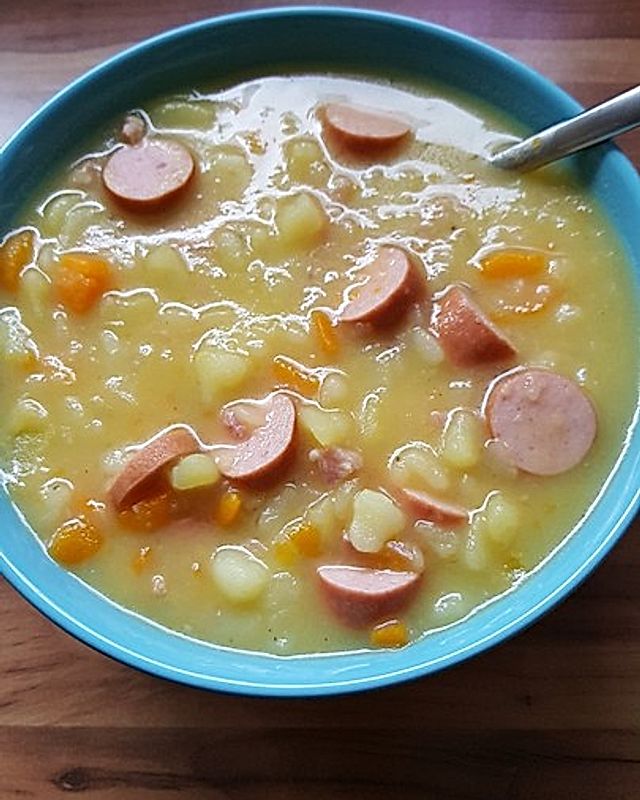
Locate an element on the screen. This screenshot has width=640, height=800. spoon handle is located at coordinates (614, 118).